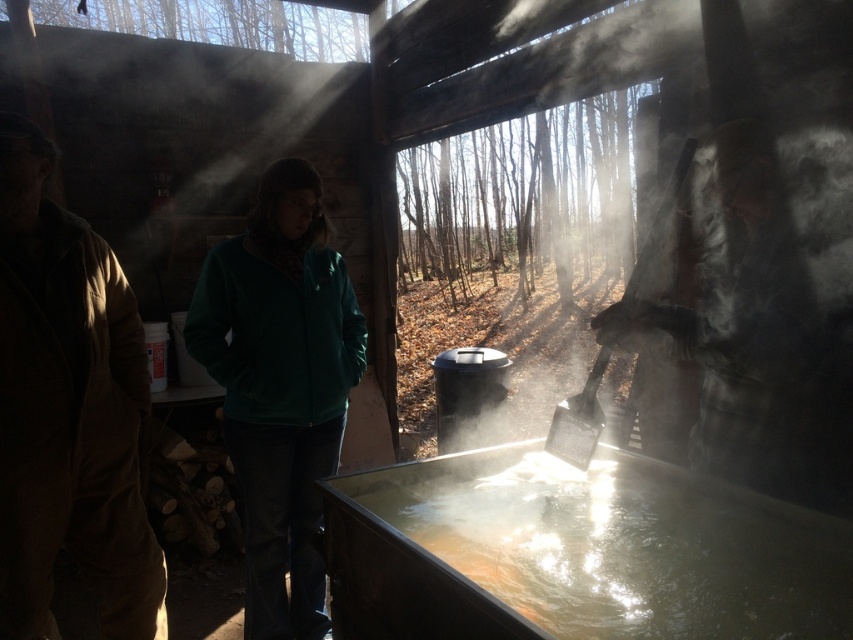
You are standing in the rustic outdoor cooking area and want to pour water from the translucent metallic water at center into a container located near the green matte jacket at center. Can you do this without moving the container?

The translucent metallic water at center is to the right of the green matte jacket at center, so you can pour the water into the container without moving it as it is already positioned to the right.

You are standing in the rustic outdoor cooking area and want to pour water from the translucent metallic water at center into a container. Where exactly should you go to access the water?

The translucent metallic water at center is located at the coordinates point (x=576, y=552), so you should go to that point to access the water.